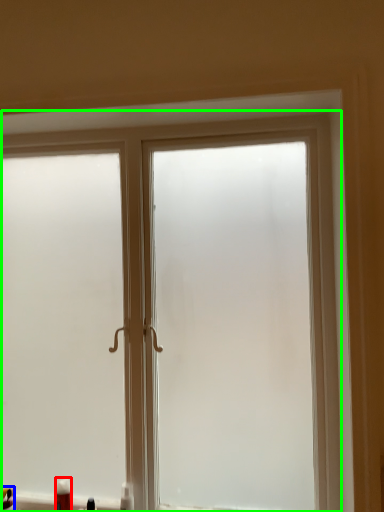
Question: Which is nearer to the toiletry (highlighted by a red box)? toiletry (highlighted by a blue box) or window (highlighted by a green box).

Choices:
 (A) toiletry
 (B) window

Answer: (A)